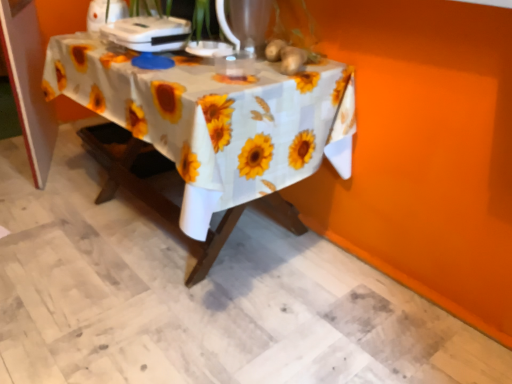
Question: Could you tell me if yellow matte sunflower at upper center, the second flower viewed from the back, is facing yellow matte sunflower at upper center, the first flower from the back?

Choices:
 (A) no
 (B) yes

Answer: (A)

Question: Is yellow matte sunflower at upper center, the 1th flower from the front, wider than yellow matte sunflower at upper center, the 2th flower from the front?

Choices:
 (A) no
 (B) yes

Answer: (B)

Question: Is yellow matte sunflower at upper center, the second flower viewed from the back, oriented away from yellow matte sunflower at upper center, the first flower from the back?

Choices:
 (A) no
 (B) yes

Answer: (A)

Question: Are yellow matte sunflower at upper center, the 1th flower from the front, and yellow matte sunflower at upper center, the 2th flower from the front, located far from each other?

Choices:
 (A) no
 (B) yes

Answer: (A)

Question: Are yellow matte sunflower at upper center, the 1th flower from the front, and yellow matte sunflower at upper center, the 2th flower from the front, making contact?

Choices:
 (A) no
 (B) yes

Answer: (B)

Question: Considering their positions, is yellow matte sunflower at upper center, the 2th flower from the front, located in front of or behind white plastic appliance at upper center, placed as the 1th appliance when sorted from right to left?

Choices:
 (A) front
 (B) behind

Answer: (B)

Question: In the image, is yellow matte sunflower at upper center, the first flower from the back, on the left side or the right side of white plastic appliance at upper center, placed as the 1th appliance when sorted from right to left?

Choices:
 (A) left
 (B) right

Answer: (B)

Question: Is point (268, 51) positioned closer to the camera than point (136, 23)?

Choices:
 (A) farther
 (B) closer

Answer: (A)

Question: Considering the positions of yellow matte sunflower at upper center, the first flower from the back, and white plastic appliance at upper center, arranged as the second appliance when viewed from the left, in the image, is yellow matte sunflower at upper center, the first flower from the back, wider or thinner than white plastic appliance at upper center, arranged as the second appliance when viewed from the left,?

Choices:
 (A) wide
 (B) thin

Answer: (B)

Question: From the image's perspective, is yellow matte sunflower at upper center, the first flower from the back, above or below white fabric tablecloth at center?

Choices:
 (A) above
 (B) below

Answer: (A)

Question: In terms of height, does yellow matte sunflower at upper center, the 2th flower from the front, look taller or shorter compared to white fabric tablecloth at center?

Choices:
 (A) short
 (B) tall

Answer: (A)

Question: From a real-world perspective, is yellow matte sunflower at upper center, the first flower from the back, above or below white fabric tablecloth at center?

Choices:
 (A) above
 (B) below

Answer: (A)

Question: In terms of size, does yellow matte sunflower at upper center, the first flower from the back, appear bigger or smaller than white fabric tablecloth at center?

Choices:
 (A) small
 (B) big

Answer: (A)

Question: Considering the positions of point (307, 51) and point (273, 49), is point (307, 51) closer or farther from the camera than point (273, 49)?

Choices:
 (A) farther
 (B) closer

Answer: (A)

Question: From a real-world perspective, is yellow matte sunflower at upper center, the second flower viewed from the back, physically located above or below yellow matte sunflower at upper center, the 2th flower from the front?

Choices:
 (A) below
 (B) above

Answer: (B)